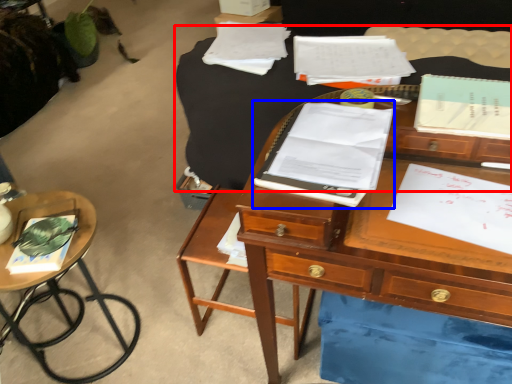
Question: Which of the following is the closest to the observer, table (highlighted by a red box) or notebook (highlighted by a blue box)?

Choices:
 (A) table
 (B) notebook

Answer: (B)